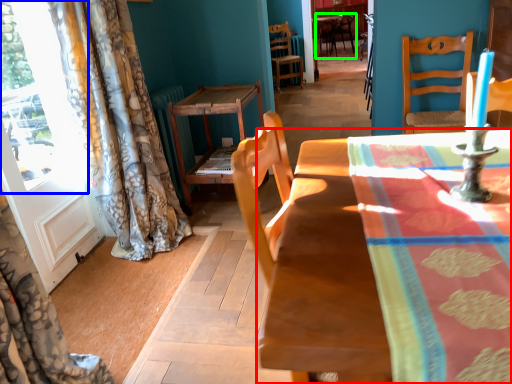
Question: Which object is the closest to the table (highlighted by a red box)? Choose among these: window (highlighted by a blue box) or chair (highlighted by a green box).

Choices:
 (A) window
 (B) chair

Answer: (A)